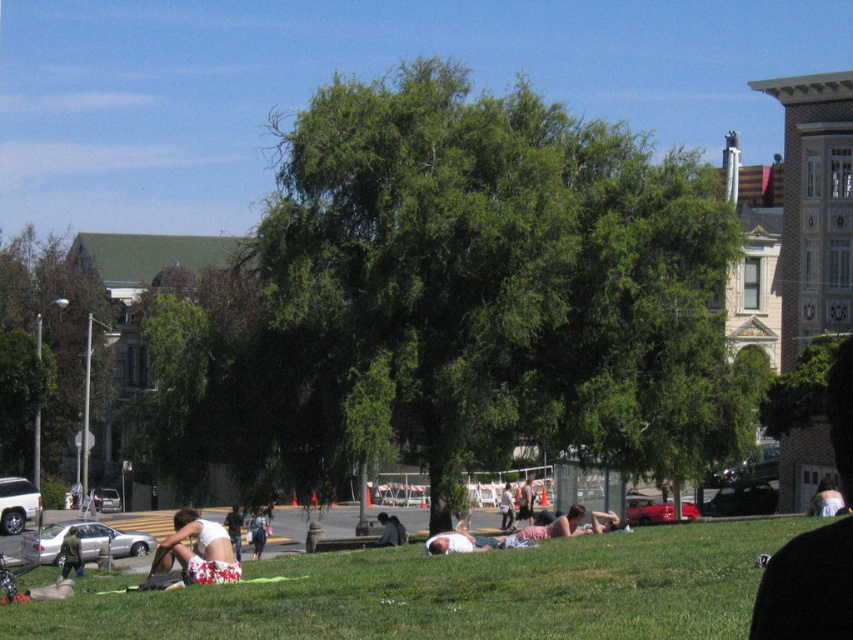
Who is shorter, green leafy tree at center or white fabric person at center?

white fabric person at center

Does green leafy tree at center appear on the left side of white fabric person at center?

Indeed, green leafy tree at center is positioned on the left side of white fabric person at center.

Between point (357, 372) and point (466, 547), which one is positioned behind?

Positioned behind is point (357, 372).

Where is `green leafy tree at center`? green leafy tree at center is located at coordinates (457, 301).

Can you confirm if green leafy tree at left is positioned to the left of white floral shorts at lower left?

Correct, you'll find green leafy tree at left to the left of white floral shorts at lower left.

Is green leafy tree at left wider than white floral shorts at lower left?

Correct, the width of green leafy tree at left exceeds that of white floral shorts at lower left.

Between point (22, 236) and point (194, 570), which one is positioned behind?

The point (22, 236) is behind.

You are a GUI agent. You are given a task and a screenshot of the screen. Output one action in this format:
    pyautogui.click(x=<x>, y=<y>)
    Task: Click on the green leafy tree at left
    The height and width of the screenshot is (640, 853).
    Given the screenshot: What is the action you would take?
    pyautogui.click(x=41, y=348)

Can you confirm if green leafy tree at center is positioned to the right of white floral shorts at lower left?

In fact, green leafy tree at center is to the left of white floral shorts at lower left.

Which of these two, green leafy tree at center or white floral shorts at lower left, stands shorter?

white floral shorts at lower left is shorter.

Where is `green leafy tree at center`? green leafy tree at center is located at coordinates (457, 301).